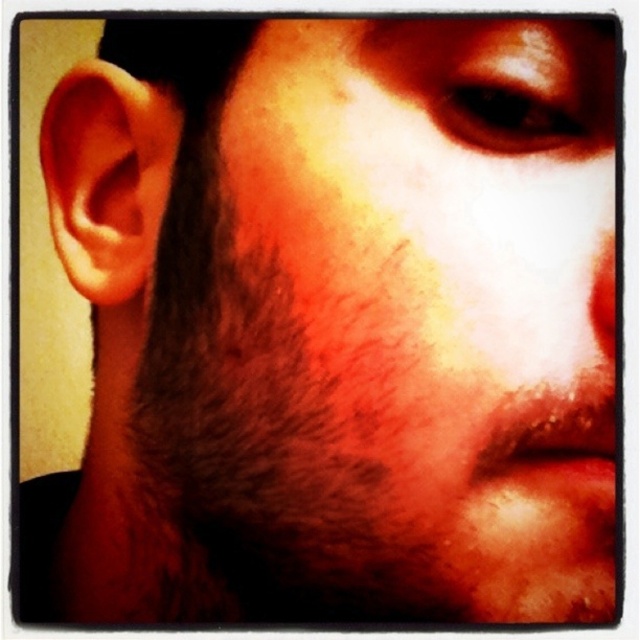
Which is more to the left, brown matte eye at upper center or matte red nose at center?

Positioned to the left is brown matte eye at upper center.

Who is more forward, [497,99] or [595,330]?

Point [497,99]

The image size is (640, 640). Find the location of `brown matte eye at upper center`. brown matte eye at upper center is located at coordinates (508, 113).

Between dark brown fuzzy beard at left and brown matte eye at upper center, which one is positioned lower?

Positioned lower is dark brown fuzzy beard at left.

Does dark brown fuzzy beard at left appear over brown matte eye at upper center?

Incorrect, dark brown fuzzy beard at left is not positioned above brown matte eye at upper center.

Is point (392, 412) positioned behind point (522, 128)?

No, it is in front of (522, 128).

Locate an element on the screen. The image size is (640, 640). dark brown fuzzy beard at left is located at coordinates (280, 412).

Is point (240, 241) more distant than point (595, 310)?

Yes.

Based on the photo, is dark brown fuzzy beard at left taller than matte red nose at center?

Correct, dark brown fuzzy beard at left is much taller as matte red nose at center.

Is point (349, 433) closer to camera compared to point (592, 307)?

Yes, it is in front of point (592, 307).

At what (x,y) coordinates should I click in order to perform the action: click on dark brown fuzzy beard at left. Please return your answer as a coordinate pair (x, y). Looking at the image, I should click on coord(280,412).